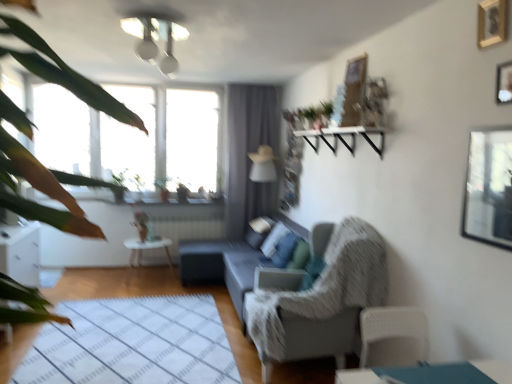
Question: Is textured gray armchair at center wider or thinner than wooden picture frame at upper right, the 2th picture frame viewed from the top?

Choices:
 (A) wide
 (B) thin

Answer: (A)

Question: From a real-world perspective, relative to wooden picture frame at upper right, which is the 1th picture frame in bottom-to-top order, is textured gray armchair at center vertically above or below?

Choices:
 (A) above
 (B) below

Answer: (B)

Question: Considering the real-world distances, which object is closest to the textured gray armchair at center?

Choices:
 (A) wooden picture frame at upper right, the 2th picture frame from the bottom
 (B) matte gray couch at center
 (C) transparent glass window screen at upper right
 (D) green leafy plant at left
 (E) white glossy light fixture at upper center

Answer: (B)

Question: Estimate the real-world distances between objects in this image. Which object is farther from the textured gray armchair at center?

Choices:
 (A) matte gray couch at center
 (B) transparent glass window screen at upper right
 (C) white glossy side table at center
 (D) green leafy plant at left
 (E) wooden picture frame at upper right, which is the 1th picture frame in bottom-to-top order

Answer: (C)